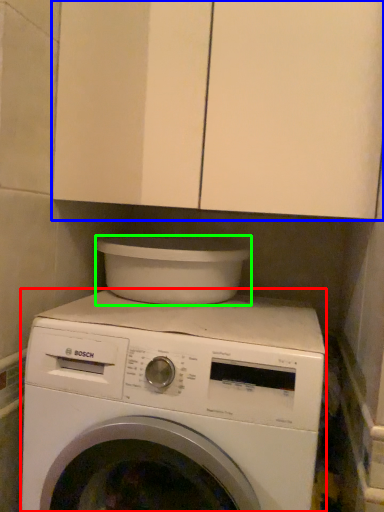
Question: Which is farther away from washing machine (highlighted by a red box)? cabinetry (highlighted by a blue box) or appliance (highlighted by a green box)?

Choices:
 (A) cabinetry
 (B) appliance

Answer: (A)